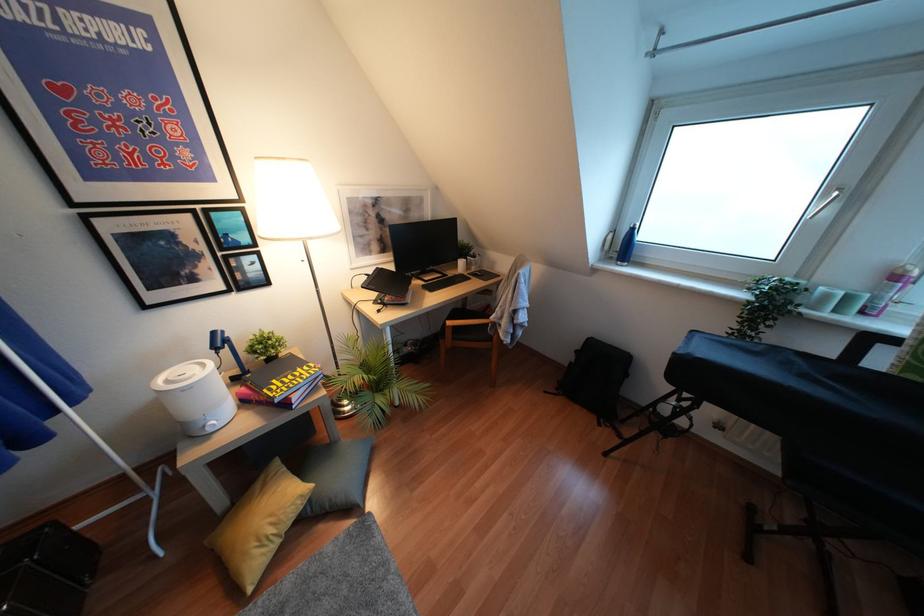
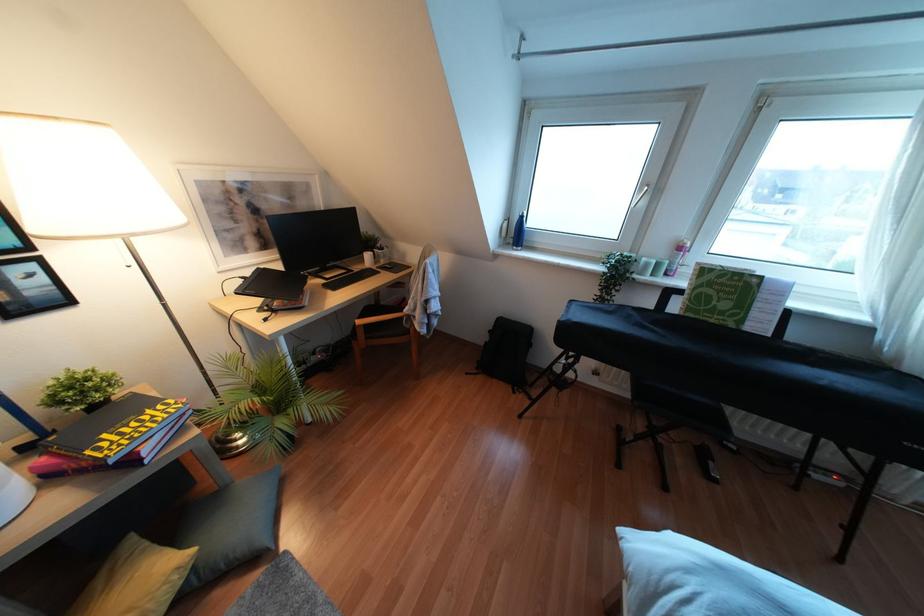
Question: The camera is either moving clockwise (left) or counter-clockwise (right) around the object. The first image is from the beginning of the video and the second image is from the end. Is the camera moving left or right when shooting the video?

Choices:
 (A) Left
 (B) Right

Answer: (A)